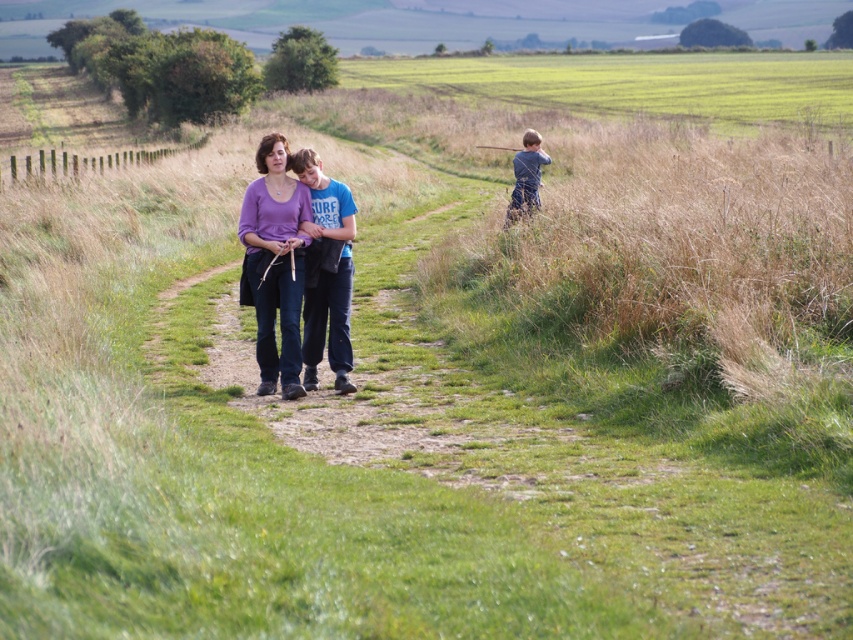
Which is more to the right, blue t-shirt at center or blue denim jeans at right?

blue denim jeans at right is more to the right.

Is point (332, 307) in front of point (523, 188)?

Yes, it is in front of point (523, 188).

Where is `blue t-shirt at center`? blue t-shirt at center is located at coordinates (326, 272).

From the picture: Who is shorter, purple matte shirt at center or blue denim jeans at right?

purple matte shirt at center

Describe the element at coordinates (274, 262) in the screenshot. I see `purple matte shirt at center` at that location.

Does point (283, 225) lie behind point (532, 172)?

No, (283, 225) is in front of (532, 172).

You are a GUI agent. You are given a task and a screenshot of the screen. Output one action in this format:
    pyautogui.click(x=<x>, y=<y>)
    Task: Click on the purple matte shirt at center
    The image size is (853, 640).
    Given the screenshot: What is the action you would take?
    [274, 262]

Image resolution: width=853 pixels, height=640 pixels. Describe the element at coordinates (274, 262) in the screenshot. I see `purple matte shirt at center` at that location.

Is purple matte shirt at center closer to camera compared to blue t-shirt at center?

Yes, purple matte shirt at center is closer to the viewer.

Is point (288, 352) closer to camera compared to point (335, 348)?

Yes, point (288, 352) is closer to viewer.

Locate an element on the screen. The height and width of the screenshot is (640, 853). purple matte shirt at center is located at coordinates (274, 262).